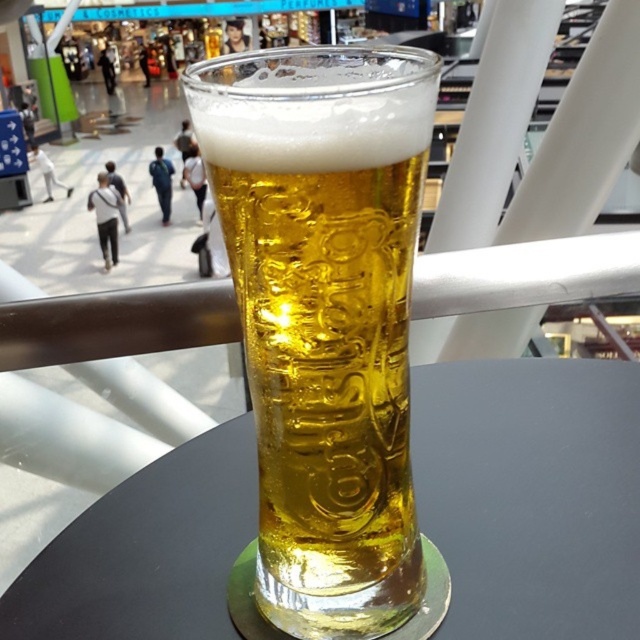
Is point (289, 618) behind point (156, 465)?

No, it is in front of (156, 465).

Between translucent glass beer at center and transparent glass at center, which one is positioned higher?

Positioned higher is translucent glass beer at center.

Find the location of a particular element. translucent glass beer at center is located at coordinates (324, 326).